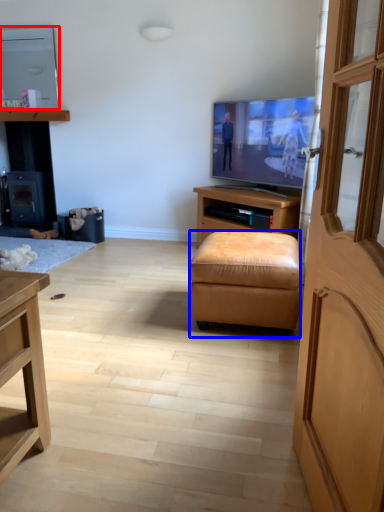
Question: Which of the following is the closest to the observer, television (highlighted by a red box) or stool (highlighted by a blue box)?

Choices:
 (A) television
 (B) stool

Answer: (B)